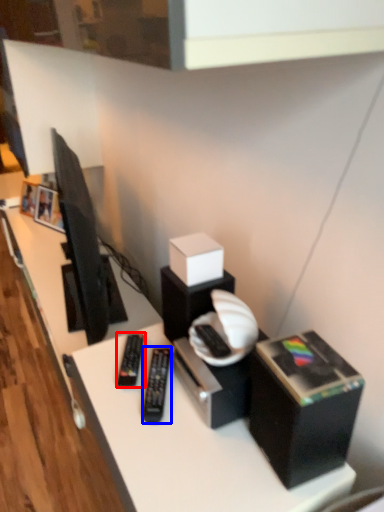
Question: Which point is closer to the camera, equipment (highlighted by a red box) or equipment (highlighted by a blue box)?

Choices:
 (A) equipment
 (B) equipment

Answer: (B)